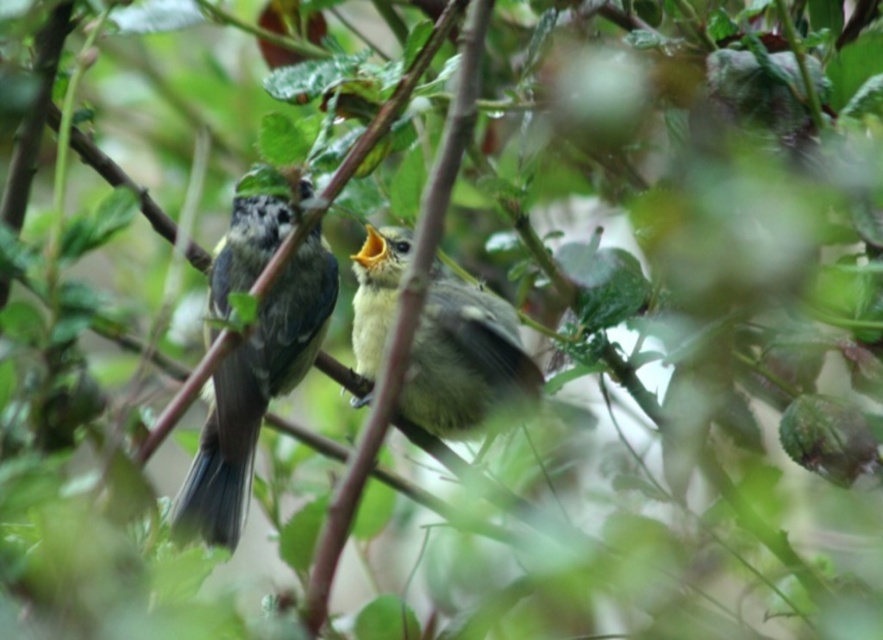
Question: From the image, what is the correct spatial relationship of speckled gray bird at center in relation to yellow-green feathers at center?

Choices:
 (A) right
 (B) left

Answer: (B)

Question: Can you confirm if speckled gray bird at center is positioned below yellow-green feathers at center?

Choices:
 (A) yes
 (B) no

Answer: (B)

Question: Does speckled gray bird at center lie behind yellow-green feathers at center?

Choices:
 (A) yes
 (B) no

Answer: (B)

Question: Which point is farther to the camera?

Choices:
 (A) yellow-green feathers at center
 (B) speckled gray bird at center

Answer: (A)

Question: Which point is closer to the camera taking this photo?

Choices:
 (A) (230, 504)
 (B) (366, 396)

Answer: (A)